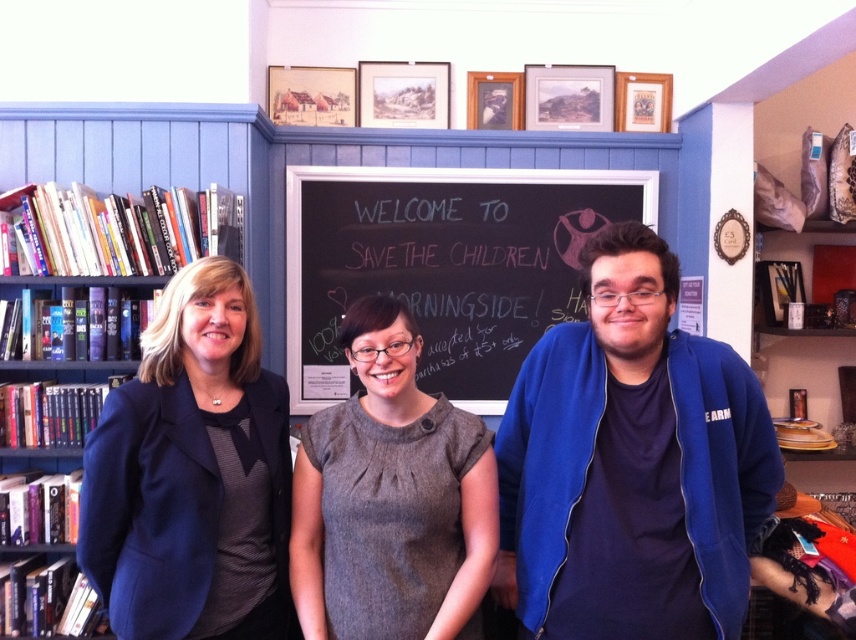
Is point (324, 237) positioned before point (461, 490)?

No, it is not.

Which is more to the left, black chalkboard at center or gray woolen dress at center?

gray woolen dress at center is more to the left.

At what (x,y) coordinates should I click in order to perform the action: click on black chalkboard at center. Please return your answer as a coordinate pair (x, y). The image size is (856, 640). Looking at the image, I should click on (443, 266).

Find the location of a particular element. The image size is (856, 640). black chalkboard at center is located at coordinates (443, 266).

Can you confirm if blue fleece jacket at center is positioned below gray woolen dress at center?

Incorrect, blue fleece jacket at center is not positioned below gray woolen dress at center.

Locate an element on the screen. The width and height of the screenshot is (856, 640). blue fleece jacket at center is located at coordinates (631, 464).

Find the location of `blue fleece jacket at center`. blue fleece jacket at center is located at coordinates (631, 464).

Is navy blue fabric jacket at left thinner than gray woolen dress at center?

Yes, navy blue fabric jacket at left is thinner than gray woolen dress at center.

Is navy blue fabric jacket at left below gray woolen dress at center?

No.

Where is `navy blue fabric jacket at left`? This screenshot has width=856, height=640. navy blue fabric jacket at left is located at coordinates (192, 474).

The width and height of the screenshot is (856, 640). What are the coordinates of `navy blue fabric jacket at left` in the screenshot? It's located at (192, 474).